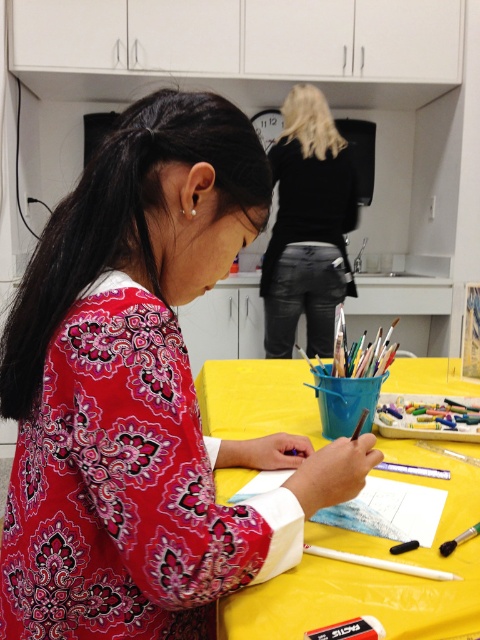
Who is positioned more to the right, patterned fabric shirt at center or black leather jacket at upper center?

black leather jacket at upper center

Can you confirm if patterned fabric shirt at center is bigger than black leather jacket at upper center?

No.

Does point (364, 460) lie behind point (327, 113)?

No, (364, 460) is closer to viewer.

Locate an element on the screen. The image size is (480, 640). patterned fabric shirt at center is located at coordinates (142, 394).

Is point (132, 385) positioned before point (384, 595)?

Yes, point (132, 385) is closer to viewer.

Is point (111, 572) farther from camera compared to point (297, 358)?

No, it is in front of (297, 358).

Between point (139, 611) and point (298, 428), which one is positioned behind?

Point (298, 428)

Where is `patterned fabric shirt at center`? This screenshot has width=480, height=640. patterned fabric shirt at center is located at coordinates [x=142, y=394].

Does yellow fabric table at center appear on the left side of black leather jacket at upper center?

Correct, you'll find yellow fabric table at center to the left of black leather jacket at upper center.

What do you see at coordinates (374, 577) in the screenshot?
I see `yellow fabric table at center` at bounding box center [374, 577].

Is point (430, 458) in front of point (288, 236)?

Yes, point (430, 458) is in front of point (288, 236).

I want to click on yellow fabric table at center, so click(x=374, y=577).